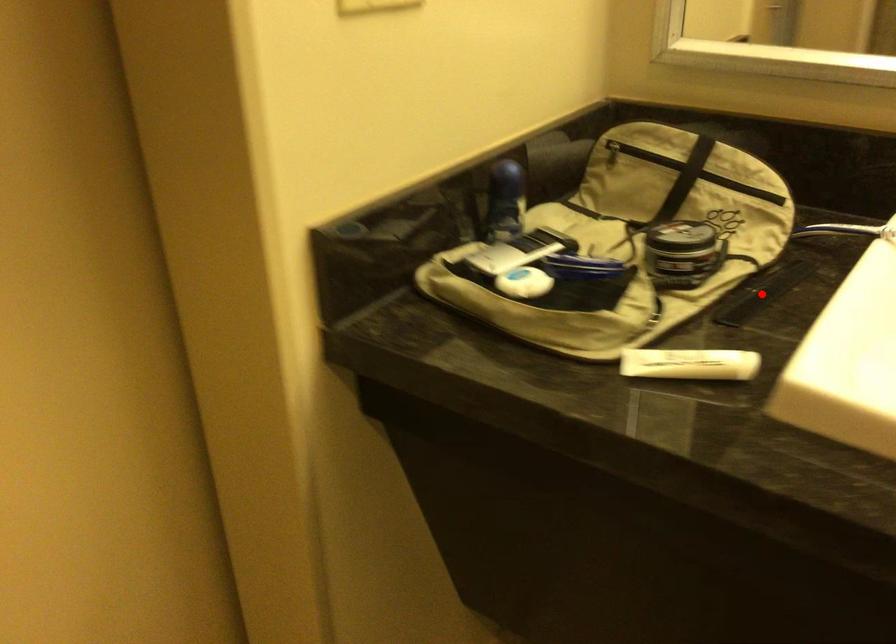
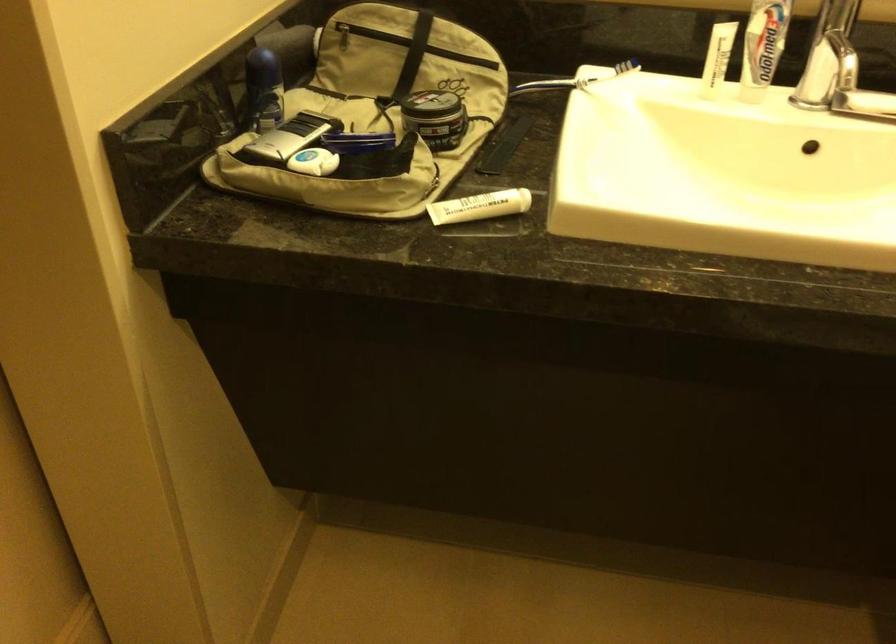
Question: A red point is marked in image1. In image2, is the corresponding 3D point closer to the camera or farther? Reply with the corresponding letter.

Choices:
 (A) The corresponding 3D point is closer.
 (B) The corresponding 3D point is farther.

Answer: (B)